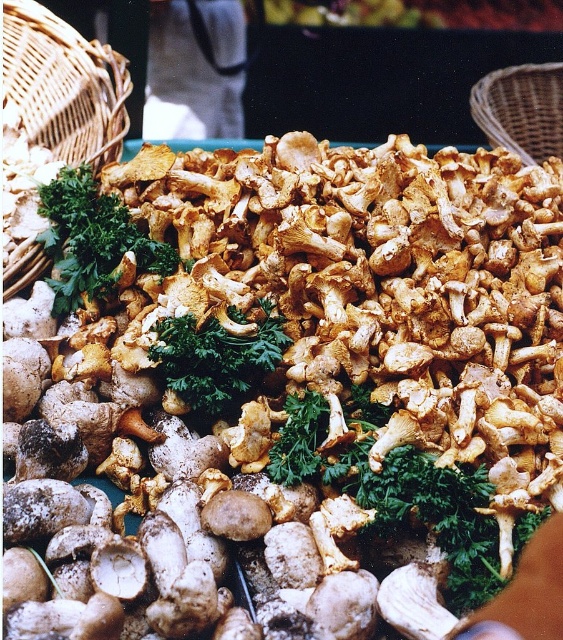
In the scene shown: You are a customer at the market and want to place the green leafy at center into the woven brown basket at upper left. Can you fit it inside without bending it?

The woven brown basket at upper left is taller than green leafy at center, so yes, the green leafy at center can fit inside the basket without bending it.

You are a customer at the market and want to buy both the woven brown basket at upper left and the woven brown basket at upper right. You have a small backpack with limited space. Which basket should you choose to carry more mushrooms?

You should choose the woven brown basket at upper right because it occupies more space and can carry more mushrooms than the woven brown basket at upper left.